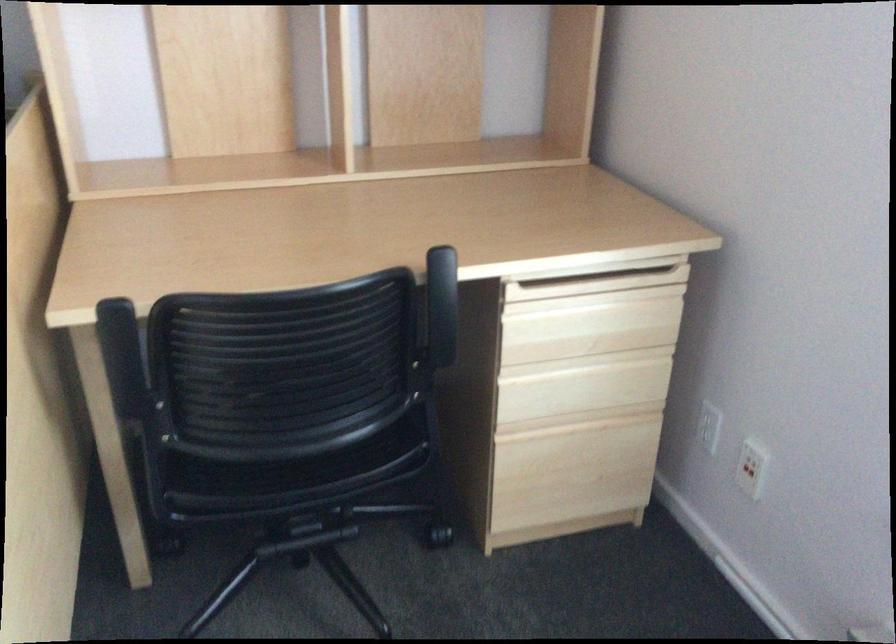
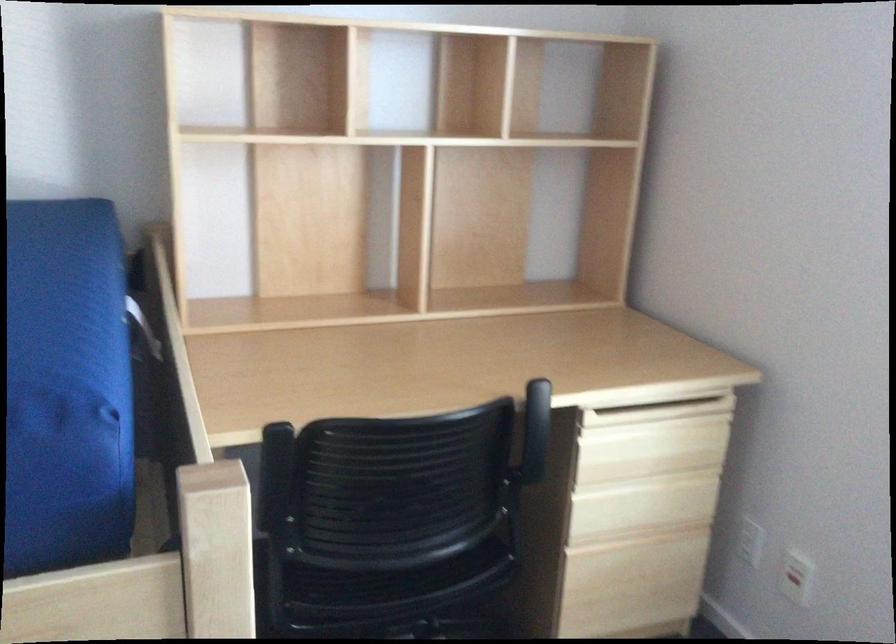
Locate, in the second image, the point that corresponds to point (707, 424) in the first image.

(750, 541)